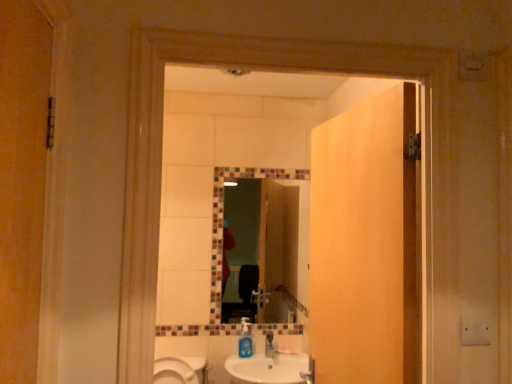
Measure the distance between point [398,275] and camera.

1.24 meters.

In order to face matte wood door at center, should I rotate leftwards or rightwards?

A 11.021 degree turn to the right will do.

What do you see at coordinates (268, 368) in the screenshot? I see `white glossy sink at lower center` at bounding box center [268, 368].

Image resolution: width=512 pixels, height=384 pixels. I want to click on blue translucent soap dispenser at center, so click(245, 339).

Image resolution: width=512 pixels, height=384 pixels. Describe the element at coordinates (245, 339) in the screenshot. I see `blue translucent soap dispenser at center` at that location.

What do you see at coordinates (265, 246) in the screenshot? I see `multicolored mosaic mirror at center` at bounding box center [265, 246].

Find the location of a particular element. This screenshot has width=512, height=384. multicolored mosaic mirror at center is located at coordinates (265, 246).

What are the coordinates of `matte wood door at center` in the screenshot? It's located at [367, 243].

The image size is (512, 384). Find the location of `sink that appears in front of the blue translucent soap dispenser at center`. sink that appears in front of the blue translucent soap dispenser at center is located at coordinates (268, 368).

Can you confirm if white glossy sink at lower center is wider than blue translucent soap dispenser at center?

Correct, the width of white glossy sink at lower center exceeds that of blue translucent soap dispenser at center.

Are white glossy sink at lower center and blue translucent soap dispenser at center far apart?

Actually, white glossy sink at lower center and blue translucent soap dispenser at center are a little close together.

Could you tell me if blue translucent soap dispenser at center is facing multicolored mosaic mirror at center?

No.

In the image, is blue translucent soap dispenser at center positioned in front of or behind multicolored mosaic mirror at center?

In the image, blue translucent soap dispenser at center appears in front of multicolored mosaic mirror at center.

Is blue translucent soap dispenser at center not near multicolored mosaic mirror at center?

Yes.

Is matte wood door at center positioned with its back to blue translucent soap dispenser at center?

No, matte wood door at center is not facing away from blue translucent soap dispenser at center.

At what (x,y) coordinates should I click in order to perform the action: click on door on the right of blue translucent soap dispenser at center. Please return your answer as a coordinate pair (x, y). This screenshot has height=384, width=512. Looking at the image, I should click on (367, 243).

Considering the positions of objects matte wood door at center and blue translucent soap dispenser at center in the image provided, who is more to the left, matte wood door at center or blue translucent soap dispenser at center?

blue translucent soap dispenser at center.

Can you confirm if matte wood door at center is thinner than blue translucent soap dispenser at center?

Incorrect, the width of matte wood door at center is not less than that of blue translucent soap dispenser at center.

Considering the sizes of objects white glossy sink at lower center and matte wood door at center in the image provided, who is shorter, white glossy sink at lower center or matte wood door at center?

Standing shorter between the two is white glossy sink at lower center.

In the scene shown: Is white glossy sink at lower center facing away from matte wood door at center?

white glossy sink at lower center is not turned away from matte wood door at center.

How different are the orientations of white glossy sink at lower center and matte wood door at center in degrees?

The facing directions of white glossy sink at lower center and matte wood door at center are 80.7 degrees apart.

Which of these two, white glossy sink at lower center or matte wood door at center, is bigger?

matte wood door at center is bigger.

Considering the relative sizes of matte wood door at center and white glossy sink at lower center in the image provided, is matte wood door at center wider than white glossy sink at lower center?

Incorrect, the width of matte wood door at center does not surpass that of white glossy sink at lower center.

Based on the photo, who is shorter, matte wood door at center or white glossy sink at lower center?

white glossy sink at lower center.

Is matte wood door at center positioned with its back to white glossy sink at lower center?

matte wood door at center is not turned away from white glossy sink at lower center.

From a real-world perspective, is matte wood door at center located higher than white glossy sink at lower center?

Yes, from a real-world perspective, matte wood door at center is on top of white glossy sink at lower center.

Is matte wood door at center in contact with multicolored mosaic mirror at center?

matte wood door at center is not next to multicolored mosaic mirror at center, and they're not touching.

There is a multicolored mosaic mirror at center. Where is `door above it (from a real-world perspective)`? This screenshot has height=384, width=512. door above it (from a real-world perspective) is located at coordinates (367, 243).

Looking at this image, between matte wood door at center and multicolored mosaic mirror at center, which one appears on the left side from the viewer's perspective?

multicolored mosaic mirror at center.

Could you tell me if matte wood door at center is turned towards multicolored mosaic mirror at center?

No, matte wood door at center does not turn towards multicolored mosaic mirror at center.

From a real-world perspective, is blue translucent soap dispenser at center positioned above or below white glossy sink at lower center?

In terms of real-world spatial position, blue translucent soap dispenser at center is above white glossy sink at lower center.

Could you tell me if blue translucent soap dispenser at center is facing white glossy sink at lower center?

Yes.

Looking at this image, does blue translucent soap dispenser at center come in front of white glossy sink at lower center?

No, blue translucent soap dispenser at center is further to the viewer.

At what (x,y) coordinates should I click in order to perform the action: click on sink below the blue translucent soap dispenser at center (from the image's perspective). Please return your answer as a coordinate pair (x, y). Looking at the image, I should click on (268, 368).

Locate an element on the screen. The image size is (512, 384). bottle on the left of multicolored mosaic mirror at center is located at coordinates (245, 339).

From the image, which object appears to be farther from white glossy sink at lower center, multicolored mosaic mirror at center or matte wood door at center?

matte wood door at center lies further to white glossy sink at lower center than the other object.

Which object lies further to the anchor point blue translucent soap dispenser at center, white glossy sink at lower center or multicolored mosaic mirror at center?

Based on the image, multicolored mosaic mirror at center appears to be further to blue translucent soap dispenser at center.

Which object lies further to the anchor point blue translucent soap dispenser at center, multicolored mosaic mirror at center or matte wood door at center?

Based on the image, matte wood door at center appears to be further to blue translucent soap dispenser at center.

Based on their spatial positions, is blue translucent soap dispenser at center or matte wood door at center closer to white glossy sink at lower center?

blue translucent soap dispenser at center is positioned closer to the anchor white glossy sink at lower center.

Looking at the image, which one is located closer to white glossy sink at lower center, blue translucent soap dispenser at center or multicolored mosaic mirror at center?

blue translucent soap dispenser at center.

When comparing their distances from multicolored mosaic mirror at center, does blue translucent soap dispenser at center or white glossy sink at lower center seem closer?

white glossy sink at lower center is closer to multicolored mosaic mirror at center.

Consider the image. Which object lies further to the anchor point multicolored mosaic mirror at center, matte wood door at center or blue translucent soap dispenser at center?

Based on the image, matte wood door at center appears to be further to multicolored mosaic mirror at center.

When comparing their distances from matte wood door at center, does multicolored mosaic mirror at center or blue translucent soap dispenser at center seem closer?

blue translucent soap dispenser at center is closer to matte wood door at center.

This screenshot has width=512, height=384. What are the coordinates of `sink between matte wood door at center and multicolored mosaic mirror at center along the z-axis` in the screenshot? It's located at (268, 368).

Image resolution: width=512 pixels, height=384 pixels. What are the coordinates of `sink located between matte wood door at center and blue translucent soap dispenser at center in the depth direction` in the screenshot? It's located at (268, 368).

This screenshot has width=512, height=384. I want to click on bottle between multicolored mosaic mirror at center and white glossy sink at lower center in the vertical direction, so click(245, 339).

This screenshot has width=512, height=384. I want to click on bottle located between matte wood door at center and multicolored mosaic mirror at center in the depth direction, so point(245,339).